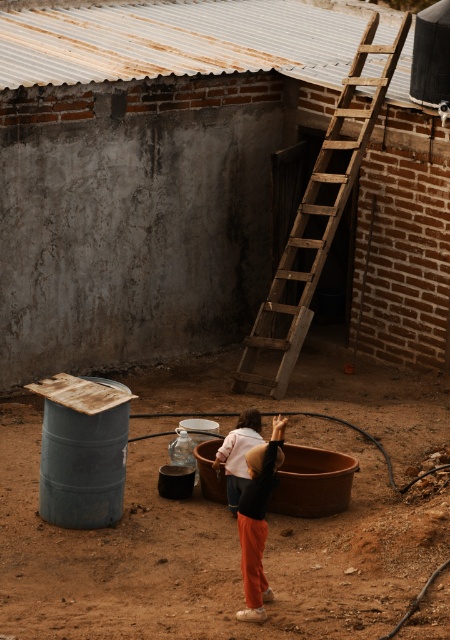
From the picture: Can you confirm if wooden at right is positioned below matte pink sweater at center?

No.

Find the location of a particular element. The image size is (450, 640). wooden at right is located at coordinates tap(319, 216).

Does point (271, 305) come behind point (234, 484)?

Yes, point (271, 305) is farther from viewer.

Where is `wooden at right`? wooden at right is located at coordinates (319, 216).

Which is behind, point (288, 429) or point (253, 497)?

Positioned behind is point (288, 429).

Between brown dirt field at center and matte black shirt at center, which one appears on the right side from the viewer's perspective?

From the viewer's perspective, matte black shirt at center appears more on the right side.

Between point (19, 596) and point (241, 548), which one is positioned in front?

Positioned in front is point (19, 596).

Where is `brown dirt field at center`? Image resolution: width=450 pixels, height=640 pixels. brown dirt field at center is located at coordinates (211, 552).

Consider the image. Between brown dirt field at center and matte pink sweater at center, which one is positioned higher?

matte pink sweater at center is above.

Can you confirm if brown dirt field at center is positioned to the left of matte pink sweater at center?

Indeed, brown dirt field at center is positioned on the left side of matte pink sweater at center.

The height and width of the screenshot is (640, 450). What do you see at coordinates (211, 552) in the screenshot?
I see `brown dirt field at center` at bounding box center [211, 552].

This screenshot has height=640, width=450. I want to click on brown dirt field at center, so click(211, 552).